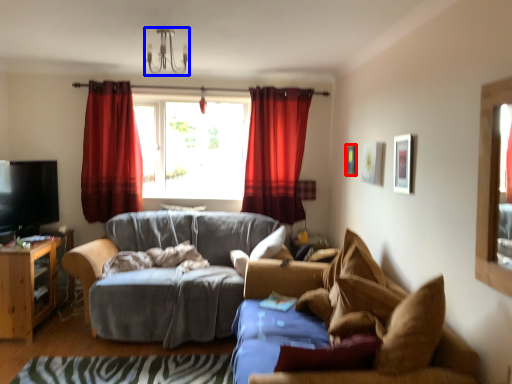
Question: Which point is closer to the camera, picture frame (highlighted by a red box) or light fixture (highlighted by a blue box)?

Choices:
 (A) picture frame
 (B) light fixture

Answer: (B)